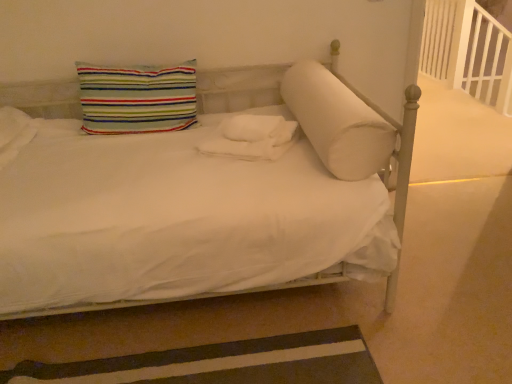
Question: Does white wooden balustrade at upper right have a lesser height compared to white fluffy blanket at center?

Choices:
 (A) yes
 (B) no

Answer: (B)

Question: Considering the relative sizes of white wooden balustrade at upper right and white fluffy blanket at center in the image provided, is white wooden balustrade at upper right taller than white fluffy blanket at center?

Choices:
 (A) no
 (B) yes

Answer: (B)

Question: Is white wooden balustrade at upper right bigger than white fluffy blanket at center?

Choices:
 (A) no
 (B) yes

Answer: (B)

Question: From the image's perspective, is white wooden balustrade at upper right on top of white fluffy blanket at center?

Choices:
 (A) no
 (B) yes

Answer: (B)

Question: Does white wooden balustrade at upper right have a greater width compared to white fluffy blanket at center?

Choices:
 (A) no
 (B) yes

Answer: (A)

Question: From a real-world perspective, is brown striped rug at lower left above or below white soft cylindrical pillow at center, the 1th pillow positioned from the right?

Choices:
 (A) above
 (B) below

Answer: (B)

Question: Considering the positions of point (349, 377) and point (344, 155), is point (349, 377) closer or farther from the camera than point (344, 155)?

Choices:
 (A) farther
 (B) closer

Answer: (B)

Question: In terms of width, does brown striped rug at lower left look wider or thinner when compared to white soft cylindrical pillow at center, the 1th pillow positioned from the right?

Choices:
 (A) wide
 (B) thin

Answer: (A)

Question: Choose the correct answer: Is brown striped rug at lower left inside white soft cylindrical pillow at center, the 2th pillow viewed from the left, or outside it?

Choices:
 (A) inside
 (B) outside

Answer: (B)

Question: Is point (243, 347) positioned closer to the camera than point (148, 107)?

Choices:
 (A) closer
 (B) farther

Answer: (A)

Question: Considering the positions of brown striped rug at lower left and striped fabric pillow at upper left, the first pillow from the left, in the image, is brown striped rug at lower left bigger or smaller than striped fabric pillow at upper left, the first pillow from the left,?

Choices:
 (A) big
 (B) small

Answer: (B)

Question: Considering the positions of brown striped rug at lower left and striped fabric pillow at upper left, the first pillow from the left, in the image, is brown striped rug at lower left wider or thinner than striped fabric pillow at upper left, the first pillow from the left,?

Choices:
 (A) wide
 (B) thin

Answer: (A)

Question: Is brown striped rug at lower left inside the boundaries of striped fabric pillow at upper left, the first pillow from the left, or outside?

Choices:
 (A) outside
 (B) inside

Answer: (A)

Question: Is white soft cylindrical pillow at center, the 1th pillow positioned from the right, situated inside brown striped rug at lower left or outside?

Choices:
 (A) inside
 (B) outside

Answer: (B)

Question: In the image, is white soft cylindrical pillow at center, the 2th pillow viewed from the left, positioned in front of or behind brown striped rug at lower left?

Choices:
 (A) behind
 (B) front

Answer: (A)